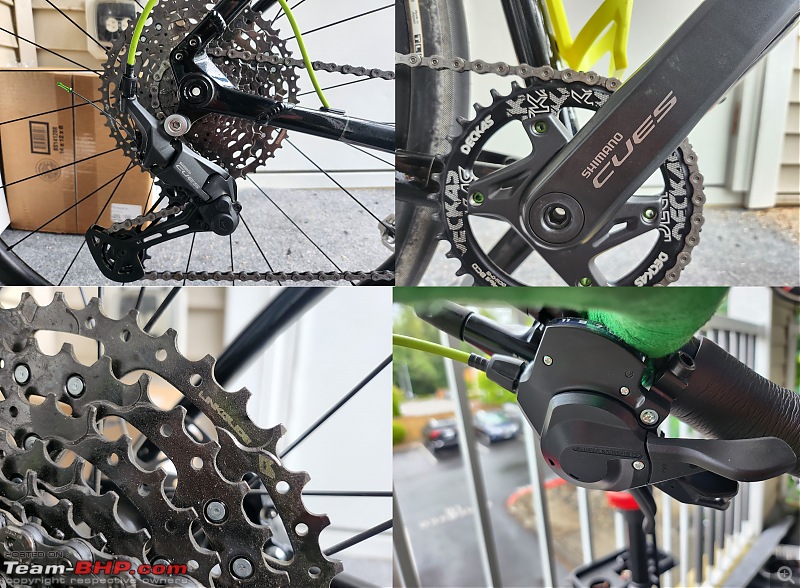
This screenshot has width=800, height=588. In order to click on cardboard box in this screenshot , I will do `click(60, 143)`.